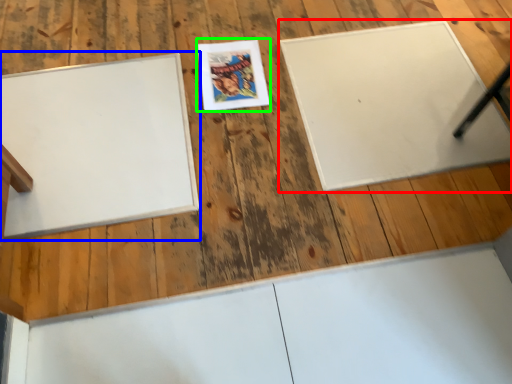
Question: Which is farther away from bulletin board (highlighted by a red box)? bulletin board (highlighted by a blue box) or comic book (highlighted by a green box)?

Choices:
 (A) bulletin board
 (B) comic book

Answer: (A)